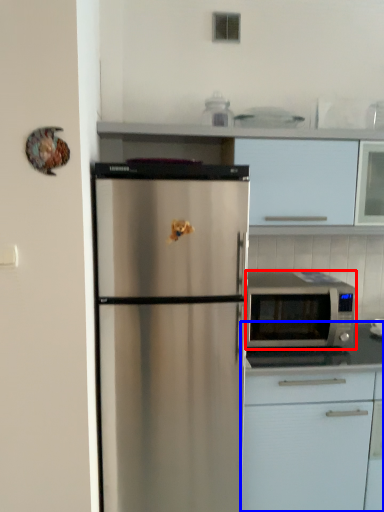
Question: Which point is further to the camera, microwave oven (highlighted by a red box) or cabinetry (highlighted by a blue box)?

Choices:
 (A) microwave oven
 (B) cabinetry

Answer: (A)